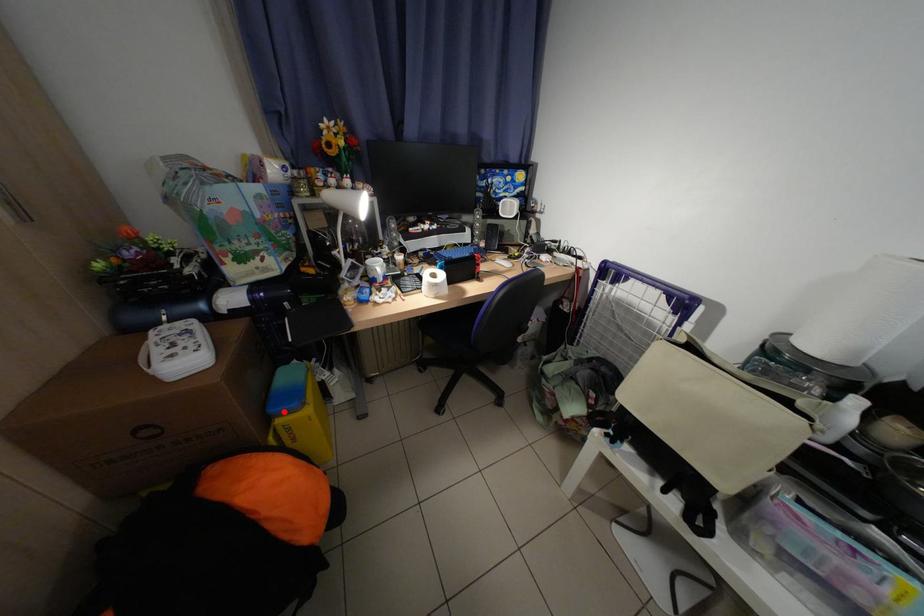
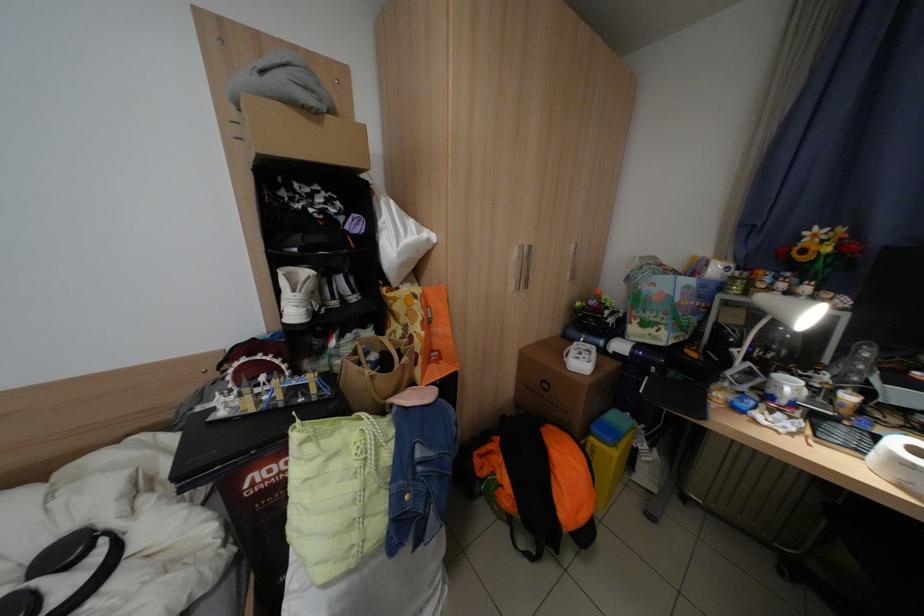
Question: I am providing you with two images of the same scene from different viewpoints. Given a red point in image1, look at the same physical point in image2. Is it:

Choices:
 (A) Closer to the viewpoint
 (B) Farther from the viewpoint

Answer: (B)